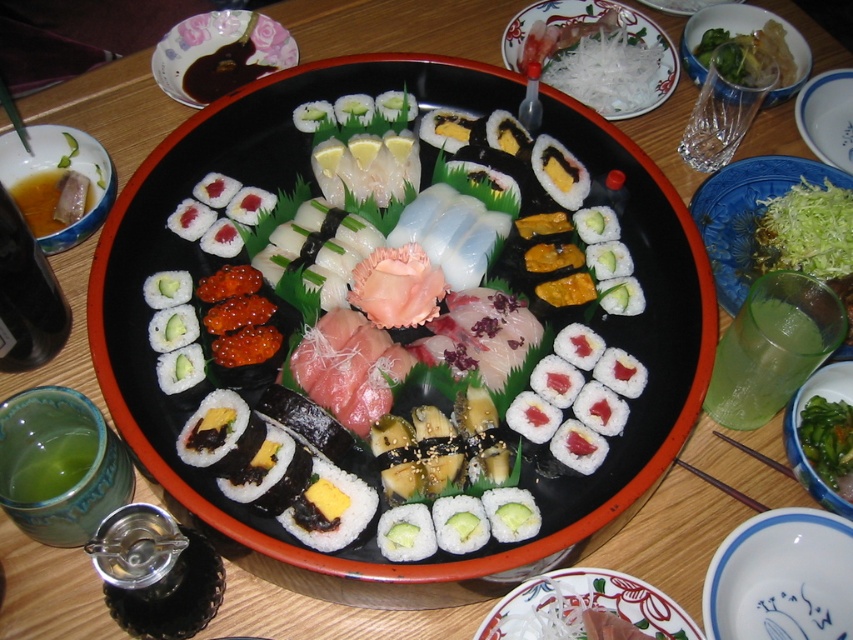
Is point (497, 611) positioned before point (732, 257)?

Yes.

Measure the distance between white paper at center and camera.

They are 70.63 centimeters apart.

In order to click on white paper at center in this screenshot , I will do `click(583, 605)`.

Is green leafy vegetable at right positioned before green leafy vegetable at center?

No, green leafy vegetable at right is further to the viewer.

Is green leafy vegetable at right wider than green leafy vegetable at center?

Yes, green leafy vegetable at right is wider than green leafy vegetable at center.

Which is in front, point (751, 182) or point (844, 449)?

Point (844, 449) is in front.

Identify the location of green leafy vegetable at right. (746, 212).

Is shiny black bowl at upper left behind green leafy vegetable at right?

Yes, shiny black bowl at upper left is behind green leafy vegetable at right.

Measure the distance between shiny black bowl at upper left and green leafy vegetable at right.

25.12 inches

Where is `shiny black bowl at upper left`? shiny black bowl at upper left is located at coordinates (219, 54).

At what (x,y) coordinates should I click in order to perform the action: click on shiny black bowl at upper left. Please return your answer as a coordinate pair (x, y). The height and width of the screenshot is (640, 853). Looking at the image, I should click on (219, 54).